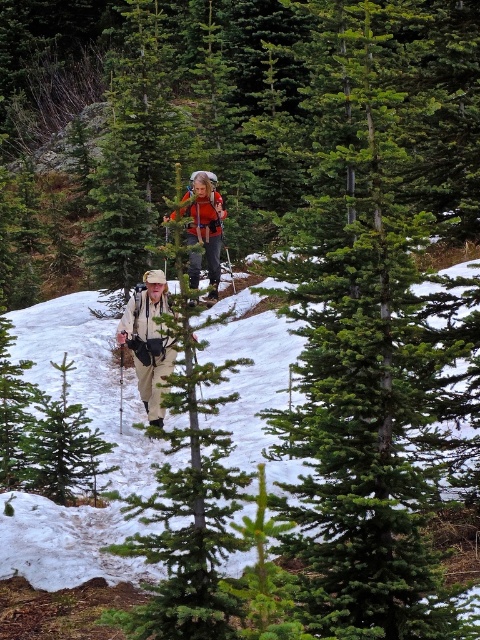
Question: Which point appears closest to the camera in this image?

Choices:
 (A) (305, 448)
 (B) (192, 276)
 (C) (156, 284)

Answer: (A)

Question: Is khaki fabric backpack at center behind orange fabric backpack at center?

Choices:
 (A) no
 (B) yes

Answer: (B)

Question: Does khaki fabric backpack at center have a lesser width compared to orange fabric backpack at center?

Choices:
 (A) no
 (B) yes

Answer: (B)

Question: Among these points, which one is farthest from the camera?

Choices:
 (A) (147, 410)
 (B) (213, 296)

Answer: (B)

Question: Which of the following is the farthest from the observer?

Choices:
 (A) khaki fabric backpack at center
 (B) green evergreen tree at center

Answer: (A)

Question: Is green evergreen tree at center wider than khaki fabric backpack at center?

Choices:
 (A) no
 (B) yes

Answer: (A)